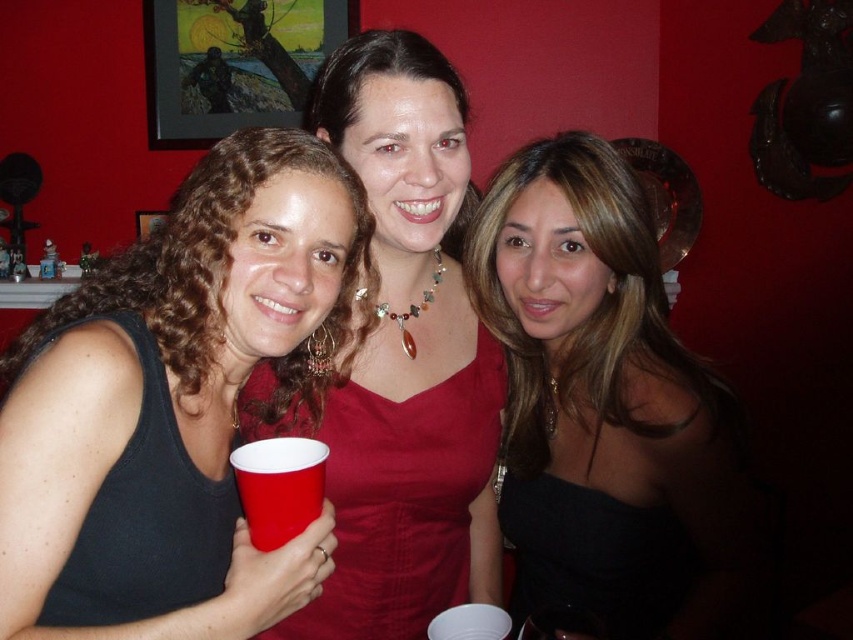
Question: Does matte red dress at center appear on the right side of black matte tank top at left?

Choices:
 (A) no
 (B) yes

Answer: (B)

Question: Can you confirm if black satin dress at center is bigger than red plastic cup at left?

Choices:
 (A) no
 (B) yes

Answer: (B)

Question: Can you confirm if matte black tank top at left is thinner than red plastic cup at left?

Choices:
 (A) no
 (B) yes

Answer: (A)

Question: Which object is positioned farthest from the black matte tank top at left?

Choices:
 (A) matte red dress at center
 (B) matte black tank top at left

Answer: (A)

Question: Estimate the real-world distances between objects in this image. Which object is closer to the black satin dress at center?

Choices:
 (A) red plastic cup at left
 (B) matte red dress at center

Answer: (B)

Question: Estimate the real-world distances between objects in this image. Which object is closer to the matte red dress at center?

Choices:
 (A) black satin dress at center
 (B) red plastic cup at left
 (C) matte black tank top at left
 (D) black matte tank top at left

Answer: (A)